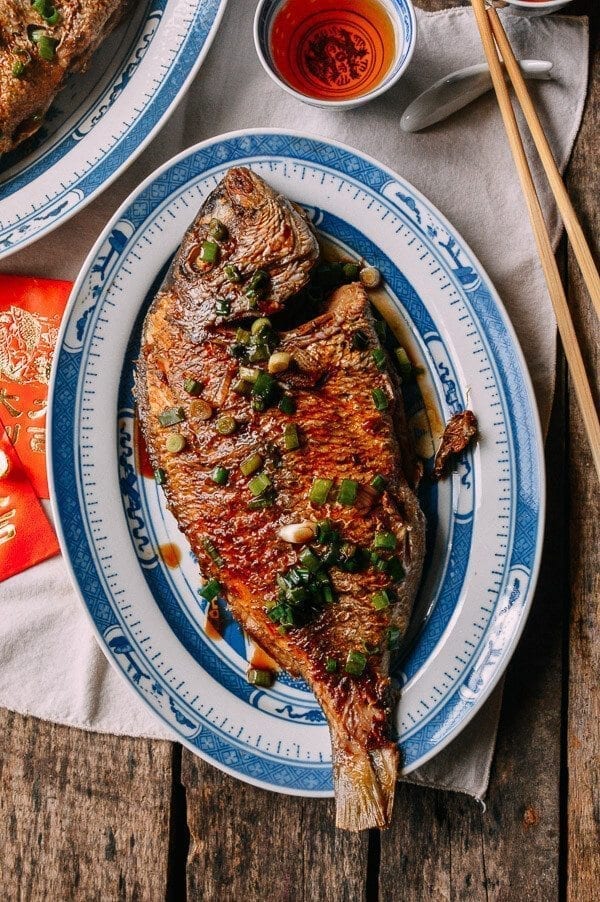
Locate an element on the screen. placemat is located at coordinates (242, 85).